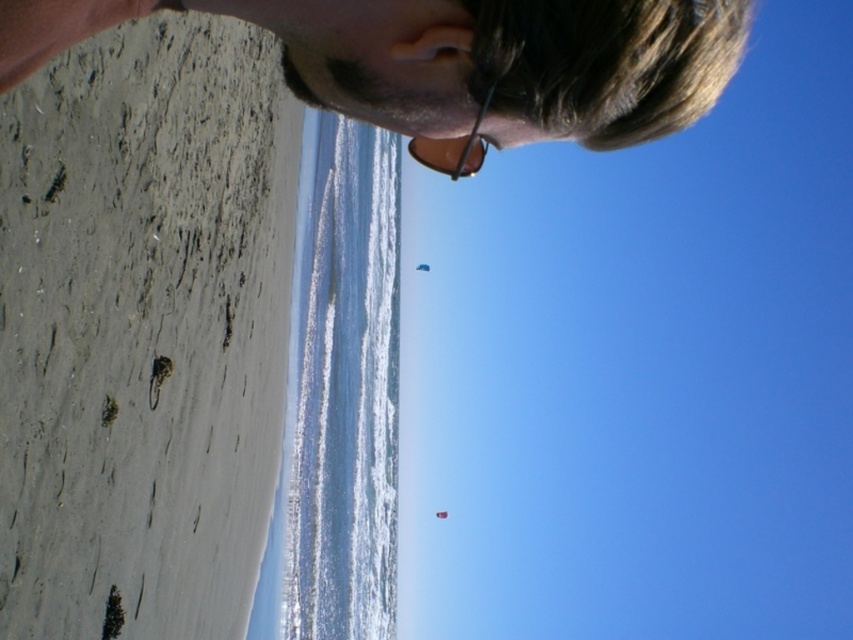
You are a photographer trying to capture the scene with both the matte black hair at upper center and the red fabric kite at upper center in the frame. Which object should you focus on first to ensure both are in the shot?

You should focus on the red fabric kite at upper center first because it is taller than the matte black hair at upper center, allowing you to frame both effectively.

You are a photographer trying to capture the reflection of the sunglasses at upper center in the water. Given that the reflection appears directly below the sunglasses, where would you aim your camera to capture the reflection? Provide the coordinates as a point in the format of the scene description.

The reflection of the sunglasses at upper center would be at point directly below its original position, so the coordinates would be approximately the same x value but mirrored vertically. Since the original sunglasses are at point 0.230 in x and 0.533 in y, the reflection would be at approximately 0.230 in x and 0.467 in y.